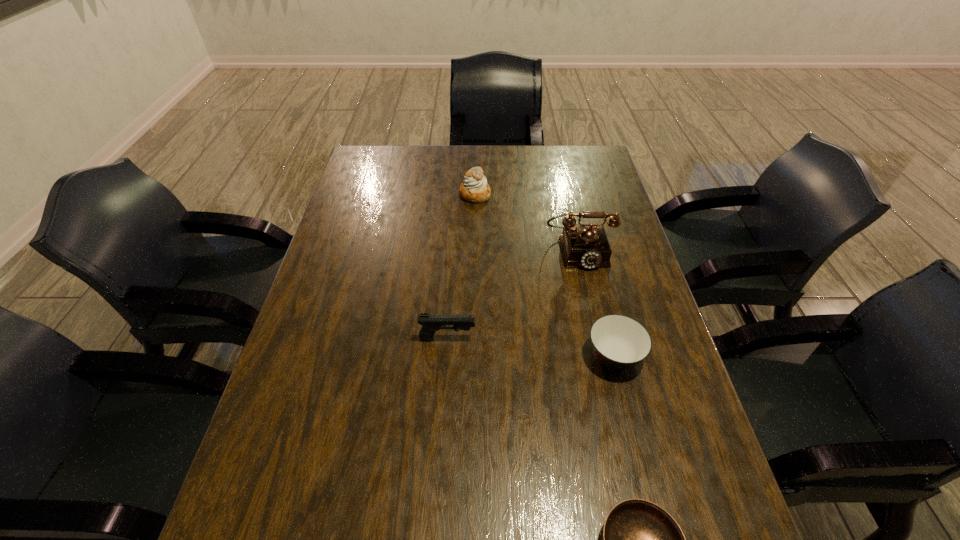
This screenshot has height=540, width=960. What are the coordinates of `empty space between the pastry and the fourth tallest object` in the screenshot? It's located at (544, 275).

Select which object appears as the second closest to the pastry. Please provide its 2D coordinates. Your answer should be formatted as a tuple, i.e. [(x, y)], where the tuple contains the x and y coordinates of a point satisfying the conditions above.

[(431, 323)]

Identify which object is the second closest to the shorter soup bowl. Please provide its 2D coordinates. Your answer should be formatted as a tuple, i.e. [(x, y)], where the tuple contains the x and y coordinates of a point satisfying the conditions above.

[(431, 323)]

In order to click on free space that satisfies the following two spatial constraints: 1. at the barrel of the farther soup bowl; 2. on the left side of the pistol in this screenshot , I will do `click(446, 357)`.

Where is `vacant space that satisfies the following two spatial constraints: 1. on the dial of the telephone; 2. at the barrel of the pistol`? This screenshot has height=540, width=960. vacant space that satisfies the following two spatial constraints: 1. on the dial of the telephone; 2. at the barrel of the pistol is located at coordinates (599, 339).